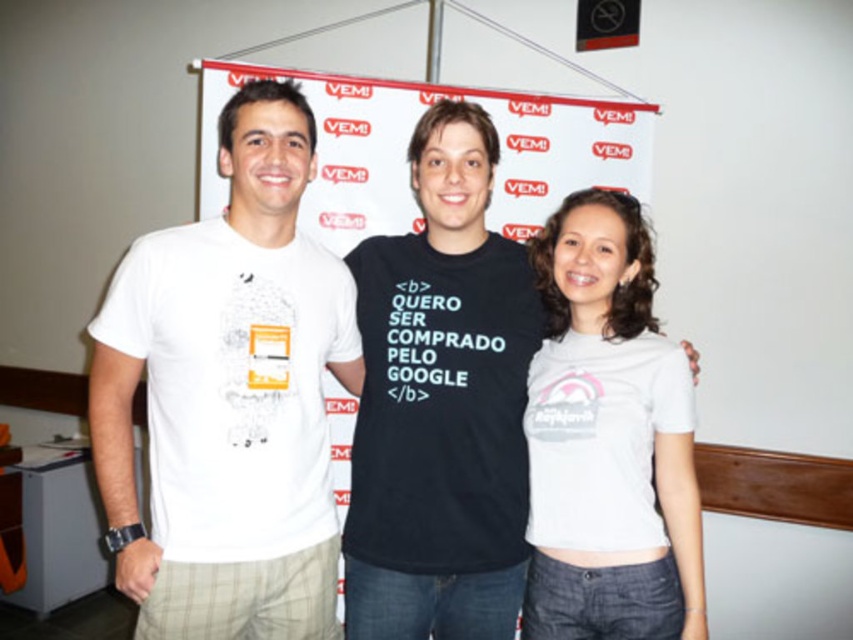
Question: Which of the following is the farthest from the observer?

Choices:
 (A) (280, 236)
 (B) (677, 397)
 (C) (393, 353)

Answer: (C)

Question: Which of the following is the farthest from the observer?

Choices:
 (A) click(456, 106)
 (B) click(177, 520)
 (C) click(554, 326)

Answer: (C)

Question: Where is white cotton t-shirt at left located in relation to black cotton t-shirt at center in the image?

Choices:
 (A) right
 (B) left

Answer: (B)

Question: Is black cotton t-shirt at center thinner than white cotton t-shirt at center?

Choices:
 (A) yes
 (B) no

Answer: (B)

Question: Which point appears closest to the camera in this image?

Choices:
 (A) (354, 625)
 (B) (689, 561)

Answer: (B)

Question: Does white cotton t-shirt at left come in front of white cotton t-shirt at center?

Choices:
 (A) yes
 (B) no

Answer: (A)